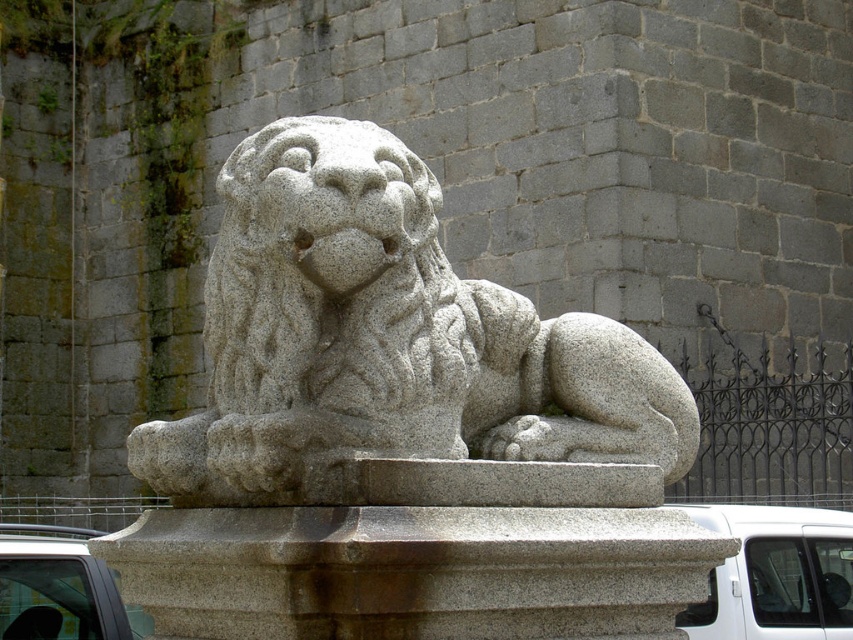
You are standing at the center of the image and want to place a new decorative item on the granite pedestal at center. According to the scene description, where exactly is the granite pedestal located?

The granite pedestal at center is located at point (413,572).

You are standing in front of the stone lion statue and want to take a photo of both the granite pedestal at center and the white matte car at lower left. Which object should you focus on first to ensure both are in frame?

You should focus on the granite pedestal at center first because it is closer to you than the white matte car at lower left, so adjusting the camera to include it will also capture the car in the background.

You are an architect designing a garden pathway that needs to be 8 feet wide. You want to place the granite lion at center and the granite pedestal at center along this path. Based on their current distance, will they fit within the pathway width?

The granite lion at center is 7.55 feet from the granite pedestal at center, which is less than the 8 feet width of the pathway. Therefore, they will fit within the pathway width.